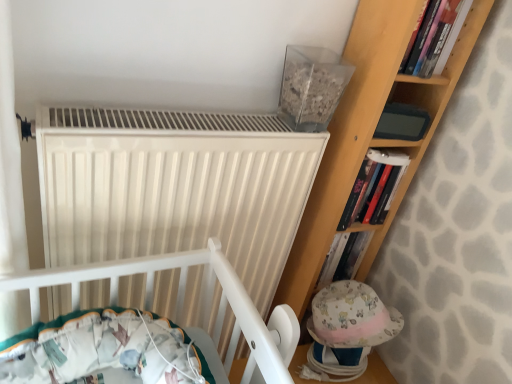
The width and height of the screenshot is (512, 384). In order to click on fluffy fabric baby hat at lower right in this screenshot , I will do `click(347, 330)`.

Describe the element at coordinates (436, 37) in the screenshot. This screenshot has height=384, width=512. I see `hardcover book at upper right, positioned as the second book in bottom-to-top order` at that location.

Locate an element on the screen. The width and height of the screenshot is (512, 384). white matte radiator at upper center is located at coordinates (174, 187).

From a real-world perspective, is matte gray paperback book at upper right located higher than hardcover book at upper right, which ranks as the 1th book in back-to-front order?

Yes, from a real-world perspective, matte gray paperback book at upper right is on top of hardcover book at upper right, which ranks as the 1th book in back-to-front order.

Is matte gray paperback book at upper right positioned with its back to hardcover book at upper right, which ranks as the first book in bottom-to-top order?

matte gray paperback book at upper right is not turned away from hardcover book at upper right, which ranks as the first book in bottom-to-top order.

This screenshot has height=384, width=512. In order to click on book below the matte gray paperback book at upper right (from a real-world perspective) in this screenshot , I will do `click(374, 187)`.

Is hardcover book at upper right, which ranks as the 1th book in back-to-front order, surrounded by matte gray paperback book at upper right?

That's incorrect, hardcover book at upper right, which ranks as the 1th book in back-to-front order, is not inside matte gray paperback book at upper right.

Is hardcover book at upper right, the 2th book when ordered from back to front, looking in the opposite direction of matte gray paperback book at upper right?

No, hardcover book at upper right, the 2th book when ordered from back to front, is not facing away from matte gray paperback book at upper right.

Does hardcover book at upper right, the 2th book when ordered from back to front, have a greater width compared to matte gray paperback book at upper right?

Yes, hardcover book at upper right, the 2th book when ordered from back to front, is wider than matte gray paperback book at upper right.

Is point (436, 12) behind point (415, 120)?

No.

Is hardcover book at upper right, arranged as the first book when viewed from the front, smaller than matte gray paperback book at upper right?

Actually, hardcover book at upper right, arranged as the first book when viewed from the front, might be larger than matte gray paperback book at upper right.

Does white matte radiator at upper center have a smaller size compared to hardcover book at upper right, the second book from the front?

No, white matte radiator at upper center is not smaller than hardcover book at upper right, the second book from the front.

Consider the image. Considering the relative sizes of white matte radiator at upper center and hardcover book at upper right, positioned as the second book in top-to-bottom order, in the image provided, is white matte radiator at upper center shorter than hardcover book at upper right, positioned as the second book in top-to-bottom order,?

In fact, white matte radiator at upper center may be taller than hardcover book at upper right, positioned as the second book in top-to-bottom order.

How much distance is there between white matte radiator at upper center and hardcover book at upper right, which ranks as the first book in bottom-to-top order?

white matte radiator at upper center and hardcover book at upper right, which ranks as the first book in bottom-to-top order, are 14.22 inches apart.

Does white matte radiator at upper center come behind hardcover book at upper right, positioned as the second book in top-to-bottom order?

No, white matte radiator at upper center is closer to the viewer.

Is hardcover book at upper right, positioned as the 1th book in top-to-bottom order, at the back of hardcover book at upper right, which ranks as the 1th book in back-to-front order?

hardcover book at upper right, which ranks as the 1th book in back-to-front order, is not turned away from hardcover book at upper right, positioned as the 1th book in top-to-bottom order.

From the image's perspective, relative to hardcover book at upper right, arranged as the first book when viewed from the front, is hardcover book at upper right, which ranks as the first book in bottom-to-top order, above or below?

Clearly, from the image's perspective, hardcover book at upper right, which ranks as the first book in bottom-to-top order, is below hardcover book at upper right, arranged as the first book when viewed from the front.

From a real-world perspective, which is physically above, hardcover book at upper right, positioned as the second book in top-to-bottom order, or hardcover book at upper right, positioned as the 1th book in top-to-bottom order?

hardcover book at upper right, positioned as the 1th book in top-to-bottom order.

Considering the relative sizes of hardcover book at upper right, positioned as the second book in bottom-to-top order, and fluffy fabric baby hat at lower right in the image provided, is hardcover book at upper right, positioned as the second book in bottom-to-top order, taller than fluffy fabric baby hat at lower right?

No, hardcover book at upper right, positioned as the second book in bottom-to-top order, is not taller than fluffy fabric baby hat at lower right.

Considering the relative sizes of hardcover book at upper right, positioned as the 1th book in top-to-bottom order, and fluffy fabric baby hat at lower right in the image provided, is hardcover book at upper right, positioned as the 1th book in top-to-bottom order, wider than fluffy fabric baby hat at lower right?

In fact, hardcover book at upper right, positioned as the 1th book in top-to-bottom order, might be narrower than fluffy fabric baby hat at lower right.

Consider the image. Which of these two, hardcover book at upper right, the 2th book when ordered from back to front, or fluffy fabric baby hat at lower right, is bigger?

With larger size is fluffy fabric baby hat at lower right.

Measure the distance from hardcover book at upper right, which ranks as the first book in bottom-to-top order, to fluffy fabric baby hat at lower right.

hardcover book at upper right, which ranks as the first book in bottom-to-top order, and fluffy fabric baby hat at lower right are 28.78 centimeters apart from each other.

Which of these two, hardcover book at upper right, the second book from the front, or fluffy fabric baby hat at lower right, is thinner?

Thinner between the two is hardcover book at upper right, the second book from the front.

Is hardcover book at upper right, which ranks as the 1th book in back-to-front order, aimed at fluffy fabric baby hat at lower right?

No, hardcover book at upper right, which ranks as the 1th book in back-to-front order, is not turned towards fluffy fabric baby hat at lower right.

Are hardcover book at upper right, the second book from the front, and fluffy fabric baby hat at lower right beside each other?

No, hardcover book at upper right, the second book from the front, is not in contact with fluffy fabric baby hat at lower right.

Could you tell me if hardcover book at upper right, which ranks as the 1th book in back-to-front order, is turned towards matte gray paperback book at upper right?

No, hardcover book at upper right, which ranks as the 1th book in back-to-front order, does not turn towards matte gray paperback book at upper right.

Is hardcover book at upper right, which ranks as the 1th book in back-to-front order, spatially inside matte gray paperback book at upper right, or outside of it?

hardcover book at upper right, which ranks as the 1th book in back-to-front order, lies outside matte gray paperback book at upper right.

From a real-world perspective, does hardcover book at upper right, which ranks as the first book in bottom-to-top order, stand above matte gray paperback book at upper right?

Actually, hardcover book at upper right, which ranks as the first book in bottom-to-top order, is physically below matte gray paperback book at upper right in the real world.

The height and width of the screenshot is (384, 512). I want to click on book located behind the matte gray paperback book at upper right, so click(x=374, y=187).

Where is `book above the matte gray paperback book at upper right (from a real-world perspective)`? book above the matte gray paperback book at upper right (from a real-world perspective) is located at coordinates (436, 37).

Estimate the real-world distances between objects in this image. Which object is closer to fluffy fabric baby hat at lower right, matte gray paperback book at upper right or white matte radiator at upper center?

white matte radiator at upper center lies closer to fluffy fabric baby hat at lower right than the other object.

Which object lies further to the anchor point white matte radiator at upper center, fluffy fabric baby hat at lower right or matte gray paperback book at upper right?

Based on the image, matte gray paperback book at upper right appears to be further to white matte radiator at upper center.

Which object lies nearer to the anchor point fluffy fabric baby hat at lower right, hardcover book at upper right, which ranks as the 1th book in back-to-front order, or matte gray paperback book at upper right?

Among the two, hardcover book at upper right, which ranks as the 1th book in back-to-front order, is located nearer to fluffy fabric baby hat at lower right.

Looking at the image, which one is located further to hardcover book at upper right, which ranks as the 1th book in back-to-front order, matte gray paperback book at upper right or fluffy fabric baby hat at lower right?

The object further to hardcover book at upper right, which ranks as the 1th book in back-to-front order, is fluffy fabric baby hat at lower right.

Based on the photo, which object lies nearer to the anchor point hardcover book at upper right, the 2th book when ordered from back to front, white matte radiator at upper center or fluffy fabric baby hat at lower right?

Based on the image, white matte radiator at upper center appears to be nearer to hardcover book at upper right, the 2th book when ordered from back to front.

From the image, which object appears to be farther from matte gray paperback book at upper right, hardcover book at upper right, arranged as the first book when viewed from the front, or fluffy fabric baby hat at lower right?

Based on the image, fluffy fabric baby hat at lower right appears to be further to matte gray paperback book at upper right.

When comparing their distances from white matte radiator at upper center, does fluffy fabric baby hat at lower right or hardcover book at upper right, positioned as the second book in top-to-bottom order, seem closer?

hardcover book at upper right, positioned as the second book in top-to-bottom order.

Which object lies further to the anchor point hardcover book at upper right, positioned as the second book in bottom-to-top order, fluffy fabric baby hat at lower right or white matte radiator at upper center?

fluffy fabric baby hat at lower right.

Where is `toy located between white matte radiator at upper center and hardcover book at upper right, the second book from the front, in the left-right direction`? The width and height of the screenshot is (512, 384). toy located between white matte radiator at upper center and hardcover book at upper right, the second book from the front, in the left-right direction is located at coordinates (347, 330).

Identify the location of paperback book between hardcover book at upper right, the 2th book when ordered from back to front, and hardcover book at upper right, positioned as the second book in top-to-bottom order, vertically. The image size is (512, 384). (402, 122).

Identify the location of paperback book between hardcover book at upper right, the 2th book when ordered from back to front, and fluffy fabric baby hat at lower right, in the vertical direction. This screenshot has width=512, height=384. [402, 122].

The height and width of the screenshot is (384, 512). What are the coordinates of `book situated between white matte radiator at upper center and matte gray paperback book at upper right from left to right` in the screenshot? It's located at (374, 187).